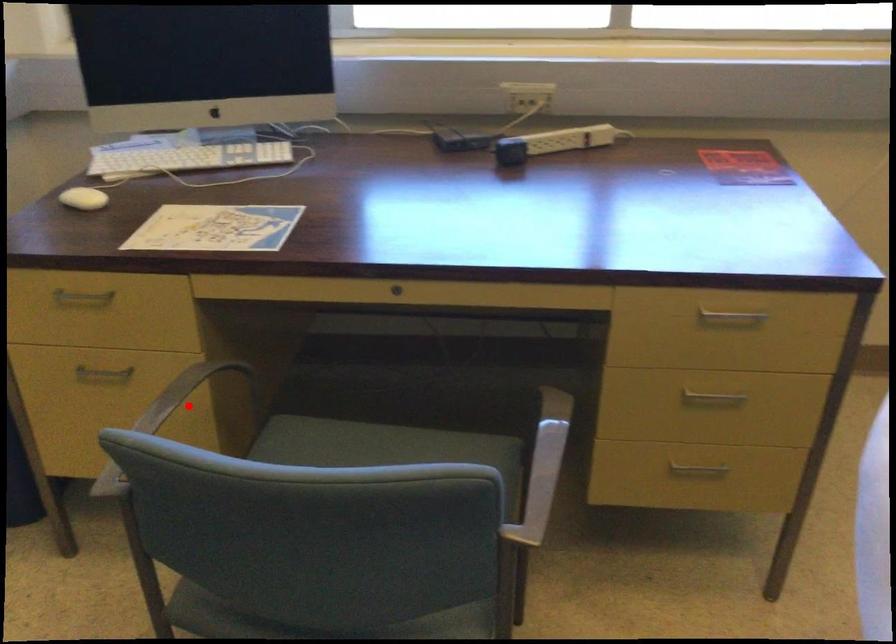
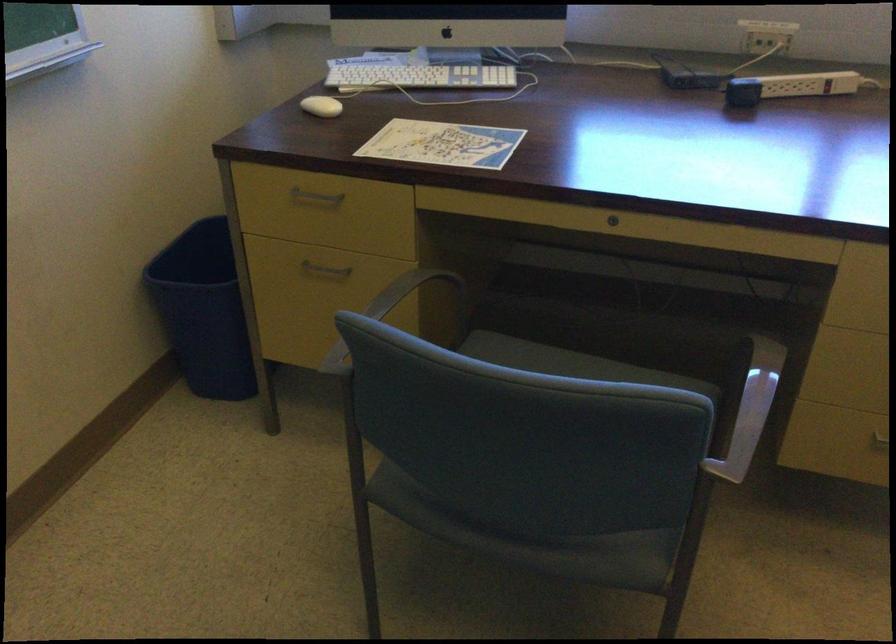
The point at the highlighted location is marked in the first image. Where is the corresponding point in the second image?

(393, 308)